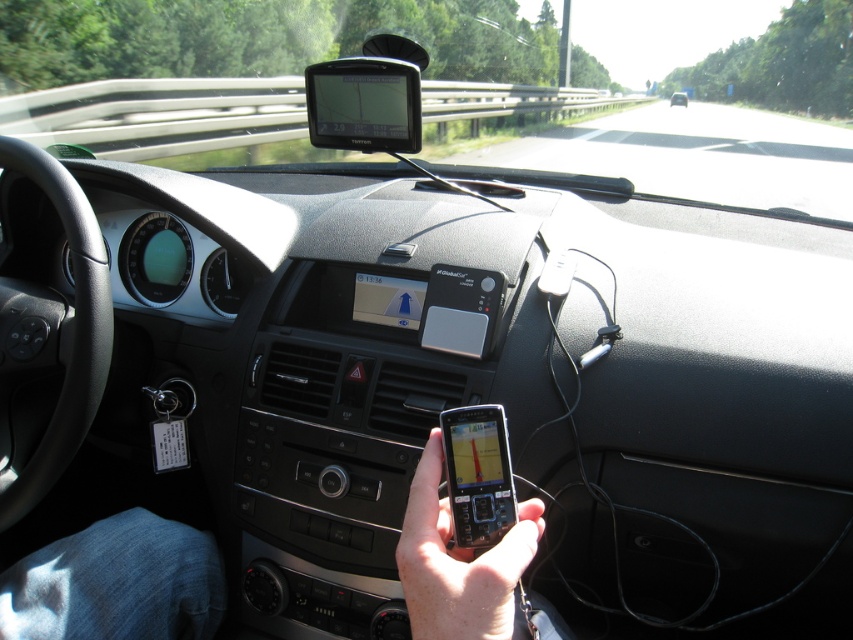
Does black plastic phone at center have a lesser height compared to matte black phone at center?

Yes, black plastic phone at center is shorter than matte black phone at center.

Does point (409, 531) come in front of point (675, 93)?

Yes, it is in front of point (675, 93).

Locate an element on the screen. The width and height of the screenshot is (853, 640). black plastic phone at center is located at coordinates (457, 561).

Who is more forward, (204, 576) or (521, 504)?

Point (521, 504) is more forward.

This screenshot has width=853, height=640. What are the coordinates of `smooth black phone at center` in the screenshot? It's located at (115, 582).

Find the location of a particular element. This screenshot has width=853, height=640. smooth black phone at center is located at coordinates (115, 582).

Is black plastic phone at center positioned before black plastic smartphone at center?

Yes, it is in front of black plastic smartphone at center.

Who is higher up, black plastic phone at center or black plastic smartphone at center?

black plastic smartphone at center

Which is in front, point (450, 592) or point (483, 545)?

Point (450, 592) is more forward.

Locate an element on the screen. The width and height of the screenshot is (853, 640). black plastic phone at center is located at coordinates (457, 561).